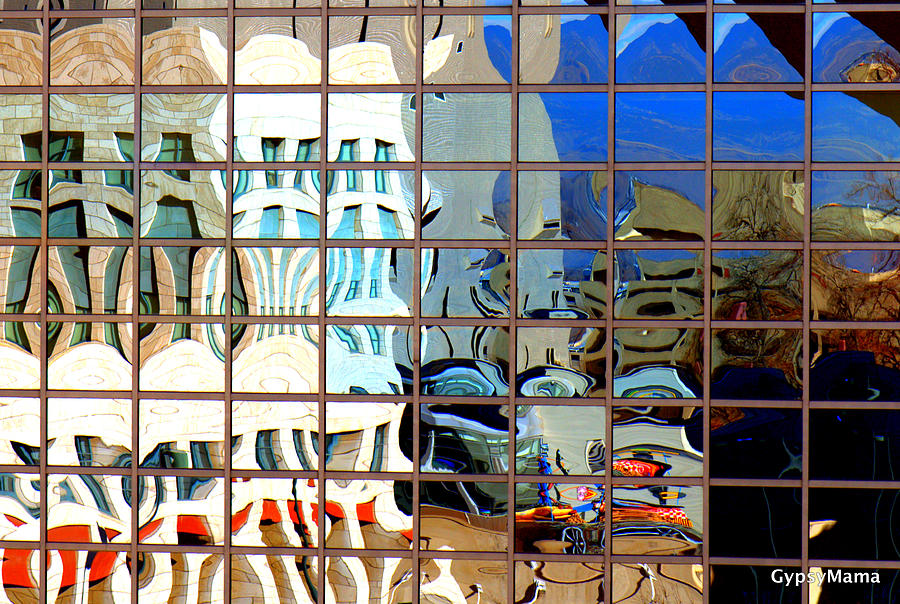
Find the location of `floor`. floor is located at coordinates (480, 577), (563, 577), (660, 580).